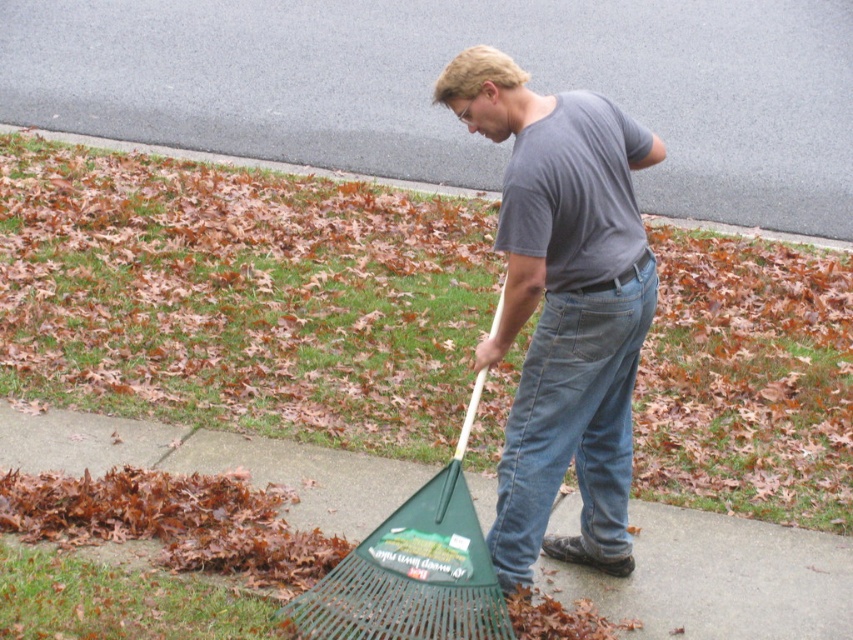
You are standing in the yard and see the gray cotton shirt at center and the green grass at lower center. Which object is positioned more to the right side?

The gray cotton shirt at center is positioned more to the right side than the green grass at lower center.